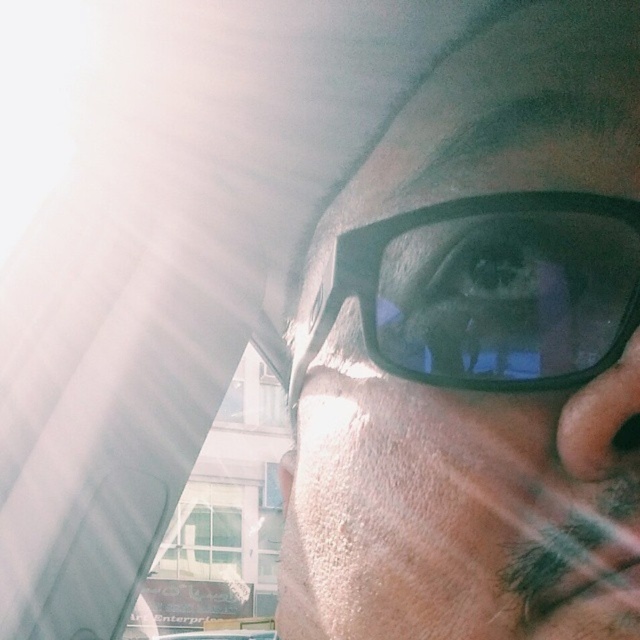
Does point (582, 371) lie behind point (602, 212)?

No.

Is point (442, 388) behind point (625, 276)?

Yes.

The width and height of the screenshot is (640, 640). Identify the location of matte black glasses at center. (477, 353).